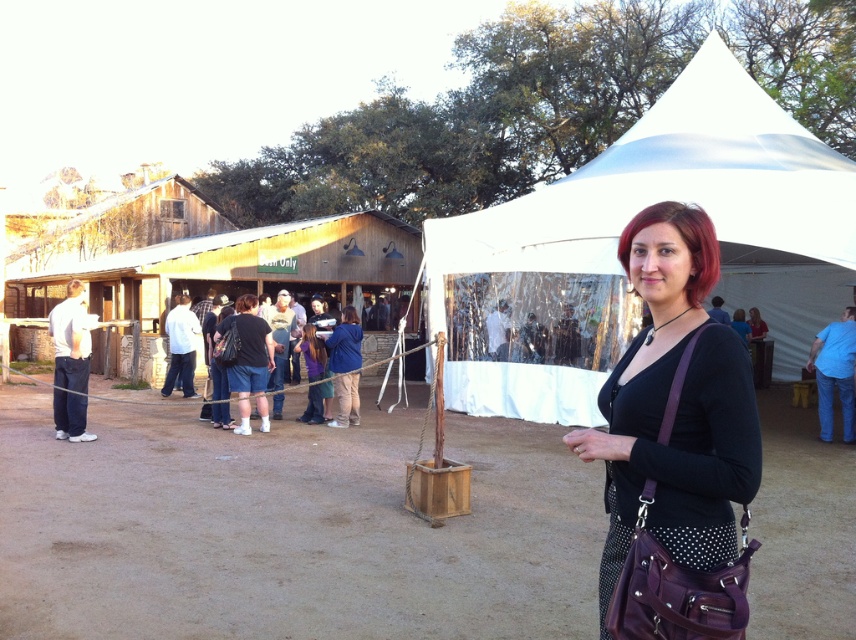
Question: Which object is farther from the camera taking this photo?

Choices:
 (A) white fabric canopy at upper right
 (B) blue denim jeans at lower right
 (C) white shirt at left

Answer: (B)

Question: Can you confirm if white fabric canopy at upper right is positioned above blue denim jeans at lower right?

Choices:
 (A) yes
 (B) no

Answer: (A)

Question: Which object is farther from the camera taking this photo?

Choices:
 (A) black dotted fabric at center
 (B) white shirt at left
 (C) blue denim jeans at lower right
 (D) white fabric canopy at upper right

Answer: (C)

Question: Does white shirt at left lie in front of blue denim jeans at lower right?

Choices:
 (A) no
 (B) yes

Answer: (B)

Question: Which point is closer to the camera taking this photo?

Choices:
 (A) (69, 308)
 (B) (840, 269)

Answer: (A)

Question: Can you confirm if white fabric canopy at upper right is thinner than white shirt at left?

Choices:
 (A) yes
 (B) no

Answer: (B)